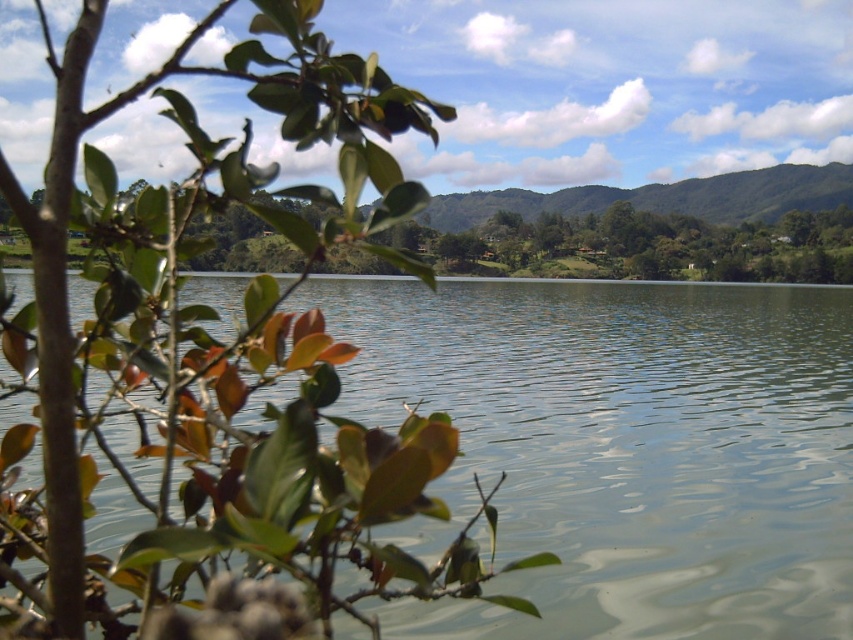
Question: From the image, what is the correct spatial relationship of green glossy leaves at left in relation to green smooth water at center?

Choices:
 (A) below
 (B) above

Answer: (B)

Question: Which object is farther from the camera taking this photo?

Choices:
 (A) green smooth water at center
 (B) green glossy leaves at left

Answer: (A)

Question: Is green glossy leaves at left to the left of green smooth water at center from the viewer's perspective?

Choices:
 (A) no
 (B) yes

Answer: (B)

Question: Does green glossy leaves at left appear under green smooth water at center?

Choices:
 (A) no
 (B) yes

Answer: (A)

Question: Which of the following is the closest to the observer?

Choices:
 (A) green glossy leaves at left
 (B) green smooth water at center

Answer: (A)